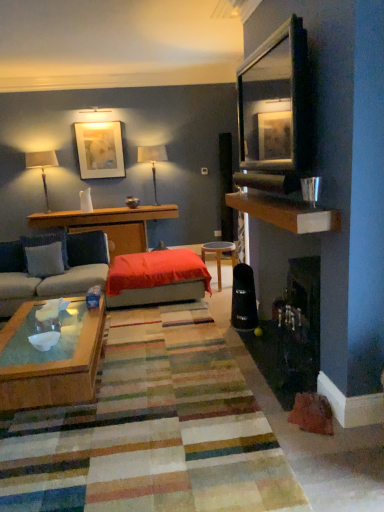
Where is `free space in front of velvet red ottoman at center`? Image resolution: width=384 pixels, height=512 pixels. free space in front of velvet red ottoman at center is located at coordinates (160, 322).